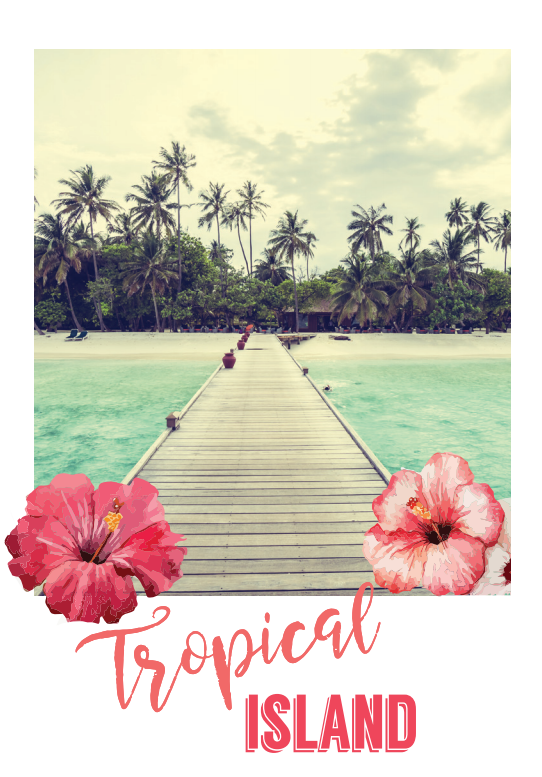
At what (x,y) coordinates should I click in order to perform the action: click on vases. Please return your answer as a coordinate pair (x, y). The image size is (542, 777). Looking at the image, I should click on (231, 361), (238, 347), (243, 338), (247, 338).